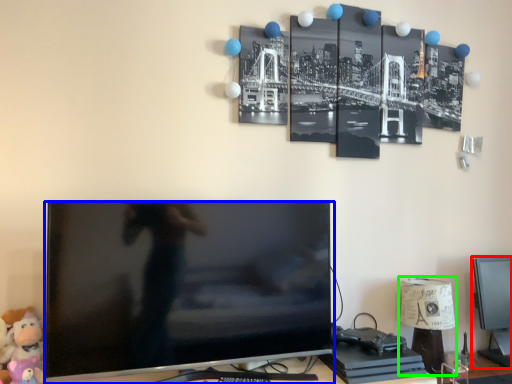
Question: Which object is the closest to the computer monitor (highlighted by a red box)? Choose among these: television (highlighted by a blue box) or table lamp (highlighted by a green box).

Choices:
 (A) television
 (B) table lamp

Answer: (B)